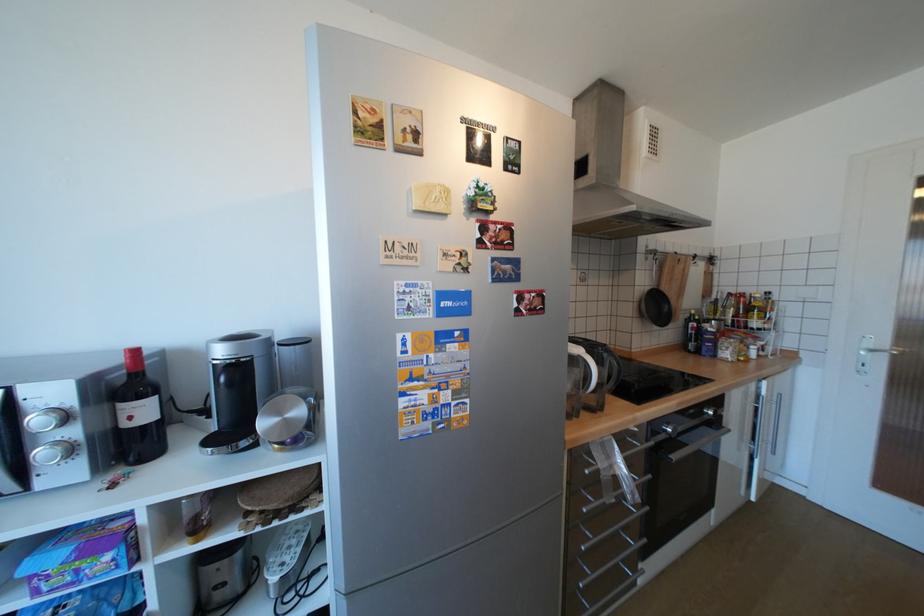
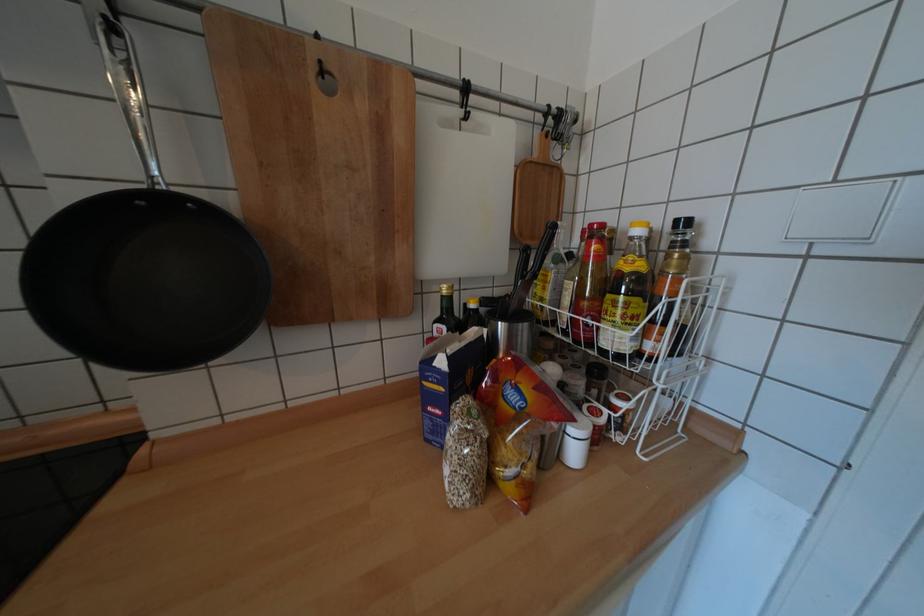
In the second image, find the point that corresponds to (x=776, y=293) in the first image.

(694, 224)